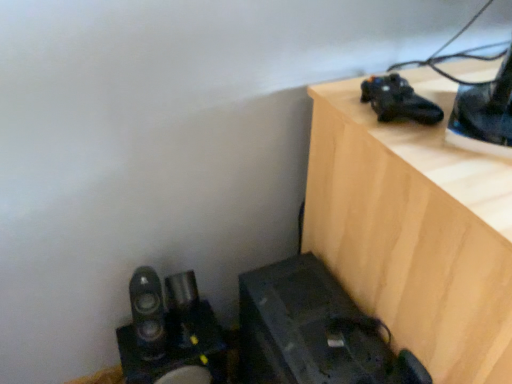
Question: Should I look upward or downward to see wooden table at upper right?

Choices:
 (A) up
 (B) down

Answer: (B)

Question: Considering the relative sizes of wooden table at upper right and black matte shoe at upper right in the image provided, is wooden table at upper right smaller than black matte shoe at upper right?

Choices:
 (A) yes
 (B) no

Answer: (B)

Question: Does wooden table at upper right have a greater width compared to black matte shoe at upper right?

Choices:
 (A) no
 (B) yes

Answer: (B)

Question: Are wooden table at upper right and black matte shoe at upper right far apart?

Choices:
 (A) no
 (B) yes

Answer: (A)

Question: Would you say wooden table at upper right is outside black matte shoe at upper right?

Choices:
 (A) yes
 (B) no

Answer: (A)

Question: From the image's perspective, is wooden table at upper right under black matte shoe at upper right?

Choices:
 (A) no
 (B) yes

Answer: (B)

Question: Does wooden table at upper right have a greater height compared to black matte shoe at upper right?

Choices:
 (A) yes
 (B) no

Answer: (A)

Question: From a real-world perspective, is wooden table at upper right over satin black speakers at lower left?

Choices:
 (A) no
 (B) yes

Answer: (B)

Question: Considering the relative sizes of wooden table at upper right and satin black speakers at lower left in the image provided, is wooden table at upper right taller than satin black speakers at lower left?

Choices:
 (A) no
 (B) yes

Answer: (B)

Question: Is wooden table at upper right positioned behind satin black speakers at lower left?

Choices:
 (A) yes
 (B) no

Answer: (B)

Question: Is satin black speakers at lower left at the back of wooden table at upper right?

Choices:
 (A) no
 (B) yes

Answer: (A)

Question: Considering the relative sizes of wooden table at upper right and satin black speakers at lower left in the image provided, is wooden table at upper right thinner than satin black speakers at lower left?

Choices:
 (A) yes
 (B) no

Answer: (B)

Question: Is wooden table at upper right placed right next to satin black speakers at lower left?

Choices:
 (A) no
 (B) yes

Answer: (A)

Question: Does black matte shoe at upper right come behind wooden table at upper right?

Choices:
 (A) no
 (B) yes

Answer: (B)